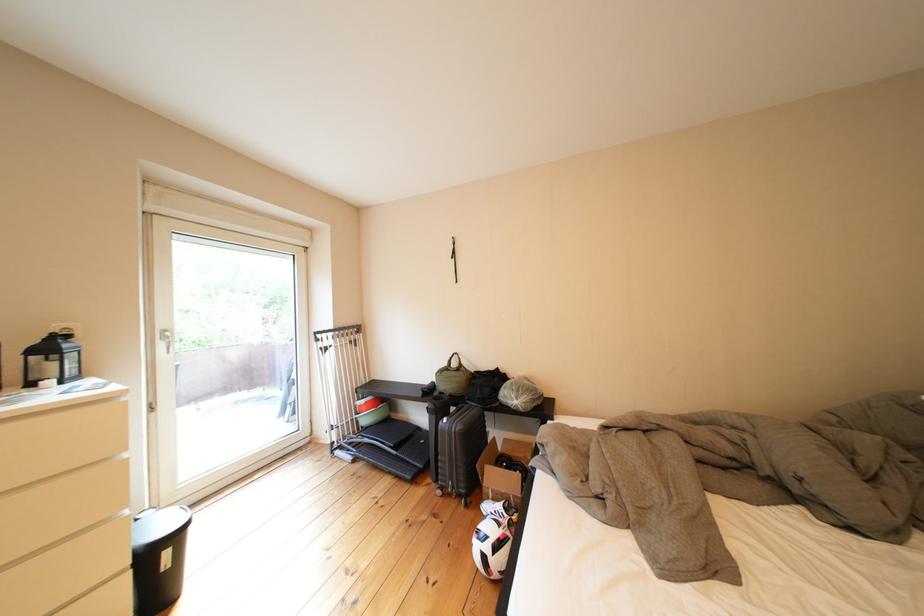
The width and height of the screenshot is (924, 616). What are the coordinates of `white door handle` in the screenshot? It's located at tap(165, 339).